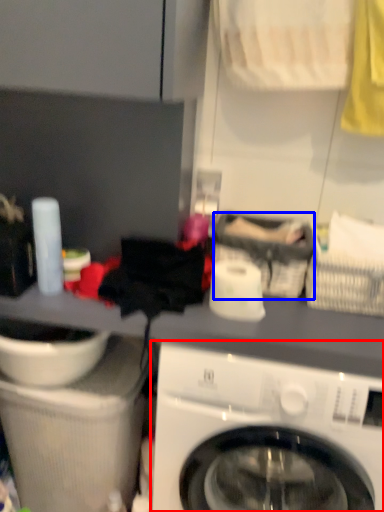
Question: Which of the following is the closest to the observer, washing machine (highlighted by a red box) or basket (highlighted by a blue box)?

Choices:
 (A) washing machine
 (B) basket

Answer: (A)